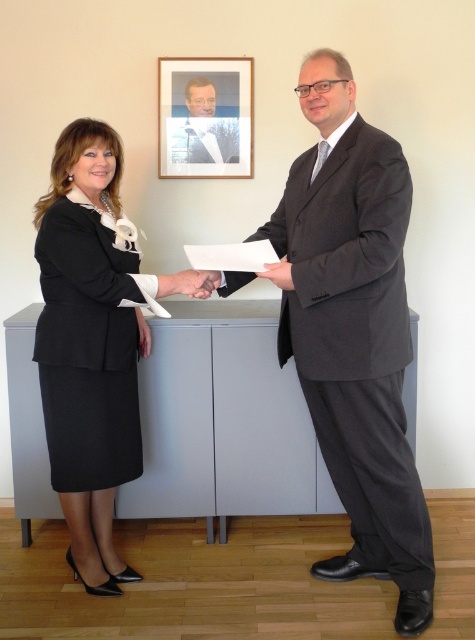
You are an event photographer who needs to capture a photo of the matte black suit at left and the wooden picture frame at upper center in the scene. Based on their positions, which object is closer to the left edge of the image?

The matte black suit at left is to the left of the wooden picture frame at upper center, so it is closer to the left edge of the image.

You are an event organizer who needs to ensure that two guests wearing the matte black suit at left and the matte black suit at center can sit side by side on a couch that is 1.8 meters wide. Based on the image, will both suits fit comfortably on the couch without overlapping?

The matte black suit at left is wider than the matte black suit at center. Since the total width of both suits combined would exceed the couch length of 1.8 meters, they may not fit comfortably without overlapping.

You are a photographer setting up for a group photo. You need to position two people wearing matte black suits so that there is enough space between them for a camera to fit. The camera requires at least 36 inches of space between subjects. Based on the current positions of the matte black suit at left and matte black suit at center, will the camera fit between them?

The distance between the matte black suit at left and matte black suit at center is 34.15 inches. Since the camera requires at least 36 inches, the camera will not fit between them in their current positions.